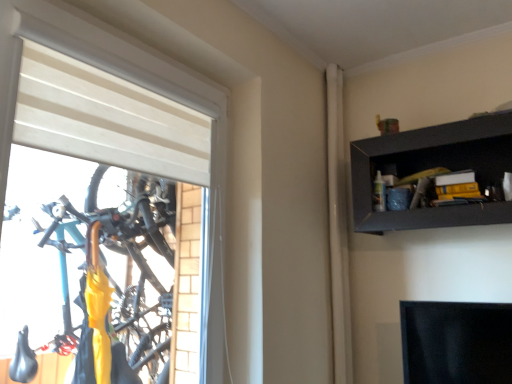
Question: From the image's perspective, is black matte shelf at upper right on white matte curtain at upper right?

Choices:
 (A) no
 (B) yes

Answer: (B)

Question: Considering the relative sizes of black matte shelf at upper right and white matte curtain at upper right in the image provided, is black matte shelf at upper right thinner than white matte curtain at upper right?

Choices:
 (A) yes
 (B) no

Answer: (B)

Question: Is black matte shelf at upper right closer to camera compared to white matte curtain at upper right?

Choices:
 (A) no
 (B) yes

Answer: (B)

Question: Is black matte shelf at upper right smaller than white matte curtain at upper right?

Choices:
 (A) no
 (B) yes

Answer: (A)

Question: From a real-world perspective, does black matte shelf at upper right sit lower than white matte curtain at upper right?

Choices:
 (A) no
 (B) yes

Answer: (A)

Question: Is black matte shelf at upper right shorter than white matte curtain at upper right?

Choices:
 (A) no
 (B) yes

Answer: (B)

Question: Can you confirm if white matte window at left is shorter than white matte curtain at upper right?

Choices:
 (A) no
 (B) yes

Answer: (B)

Question: Does white matte window at left have a larger size compared to white matte curtain at upper right?

Choices:
 (A) yes
 (B) no

Answer: (A)

Question: From a real-world perspective, is white matte window at left located beneath white matte curtain at upper right?

Choices:
 (A) no
 (B) yes

Answer: (B)

Question: Would you consider white matte window at left to be distant from white matte curtain at upper right?

Choices:
 (A) no
 (B) yes

Answer: (A)

Question: From the image's perspective, is white matte window at left on top of white matte curtain at upper right?

Choices:
 (A) no
 (B) yes

Answer: (B)

Question: Is white matte window at left positioned behind white matte curtain at upper right?

Choices:
 (A) no
 (B) yes

Answer: (A)

Question: Is the position of black matte shelf at upper right less distant than that of white matte window at left?

Choices:
 (A) no
 (B) yes

Answer: (A)